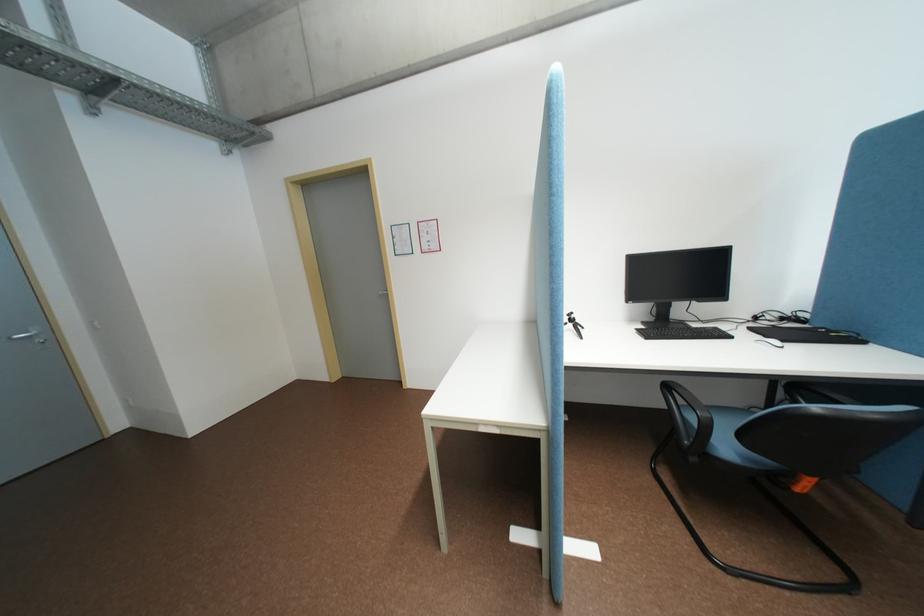
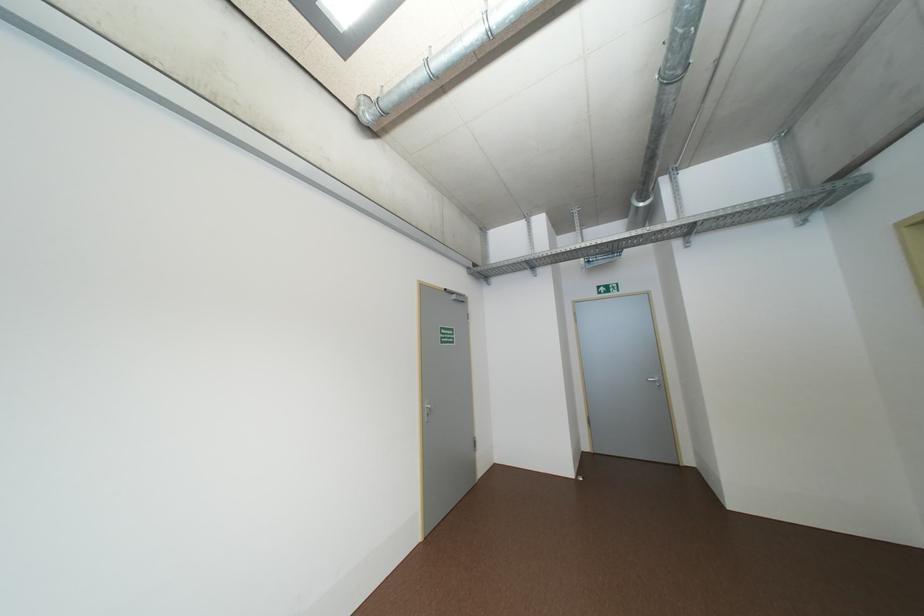
Question: How did the camera likely rotate?

Choices:
 (A) Left
 (B) Right
 (C) Up
 (D) Down

Answer: (A)